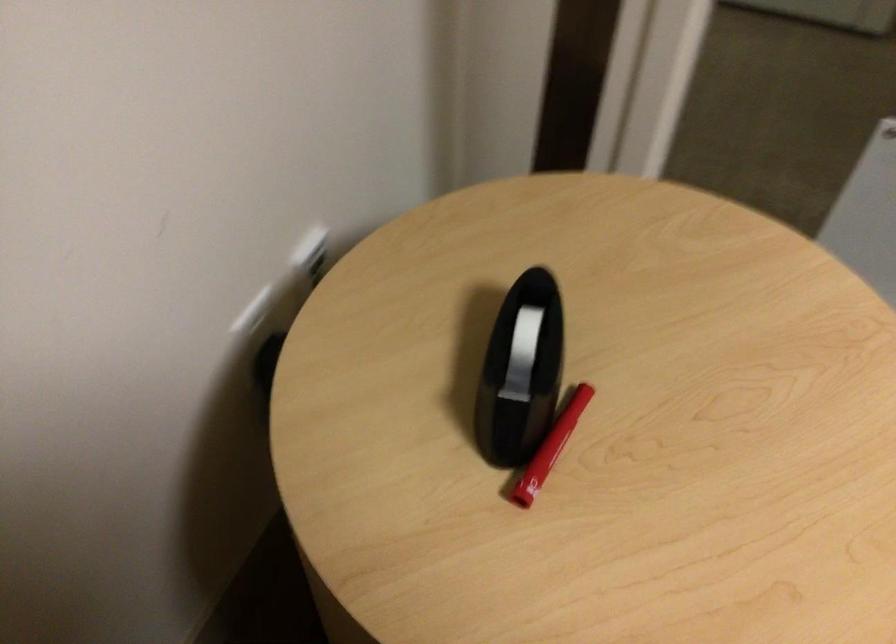
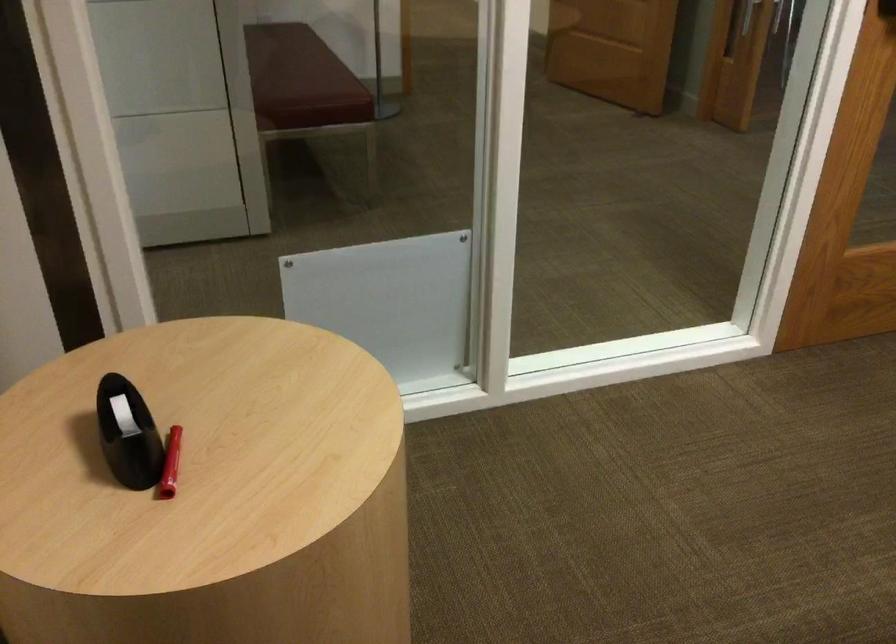
Where in the second image is the point corresponding to pixel 517 381 from the first image?

(127, 433)